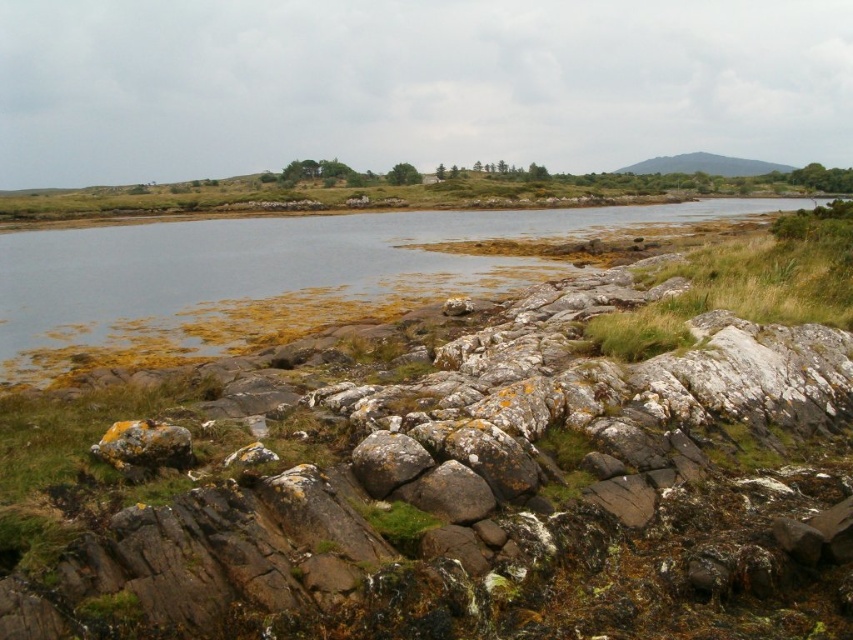
Question: Does green grassy at right lie behind green leafy bush at center?

Choices:
 (A) no
 (B) yes

Answer: (A)

Question: Which point is closer to the camera?

Choices:
 (A) (405, 173)
 (B) (816, 205)

Answer: (B)

Question: Among these points, which one is farthest from the camera?

Choices:
 (A) (184, 429)
 (B) (415, 168)
 (C) (631, 339)

Answer: (B)

Question: Which point appears closest to the camera in this image?

Choices:
 (A) (173, 448)
 (B) (231, 346)

Answer: (A)

Question: Is green grassy at right smaller than yellow lichen-covered rock at lower left?

Choices:
 (A) no
 (B) yes

Answer: (A)

Question: Can you confirm if green algae-covered water at center is thinner than yellow lichen-covered rock at lower left?

Choices:
 (A) yes
 (B) no

Answer: (B)